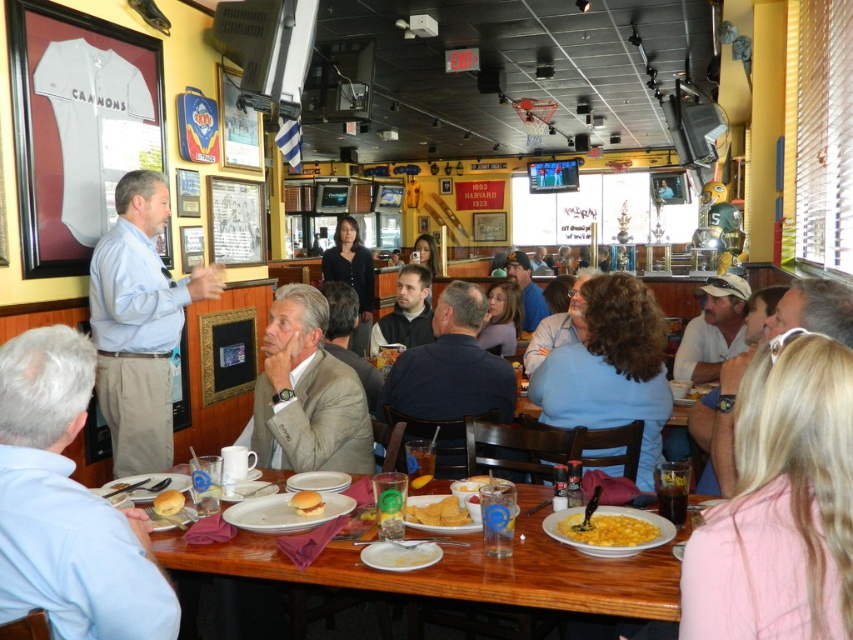
The width and height of the screenshot is (853, 640). What do you see at coordinates (451, 365) in the screenshot? I see `dark blue shirt at center` at bounding box center [451, 365].

Can you confirm if dark blue shirt at center is taller than golden bread at center?

Correct, dark blue shirt at center is much taller as golden bread at center.

Does point (486, 378) come in front of point (158, 500)?

No, (486, 378) is further to viewer.

Image resolution: width=853 pixels, height=640 pixels. I want to click on dark blue shirt at center, so click(x=451, y=365).

Is light blue shirt at left smaller than light blue sweater at center?

Actually, light blue shirt at left might be larger than light blue sweater at center.

Identify the location of light blue shirt at left. The image size is (853, 640). click(x=138, y=324).

Does wooden table at lower center lie behind dark gray sweater at center?

That is False.

What do you see at coordinates (558, 576) in the screenshot?
I see `wooden table at lower center` at bounding box center [558, 576].

Which is behind, point (496, 595) or point (430, 314)?

The point (430, 314) is behind.

This screenshot has width=853, height=640. Find the location of `wooden table at lower center`. wooden table at lower center is located at coordinates click(x=558, y=576).